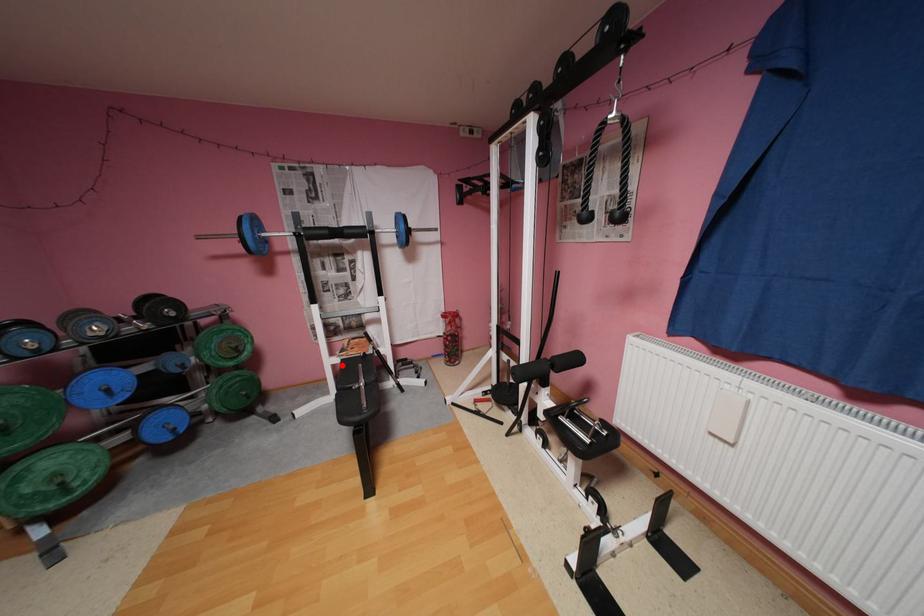
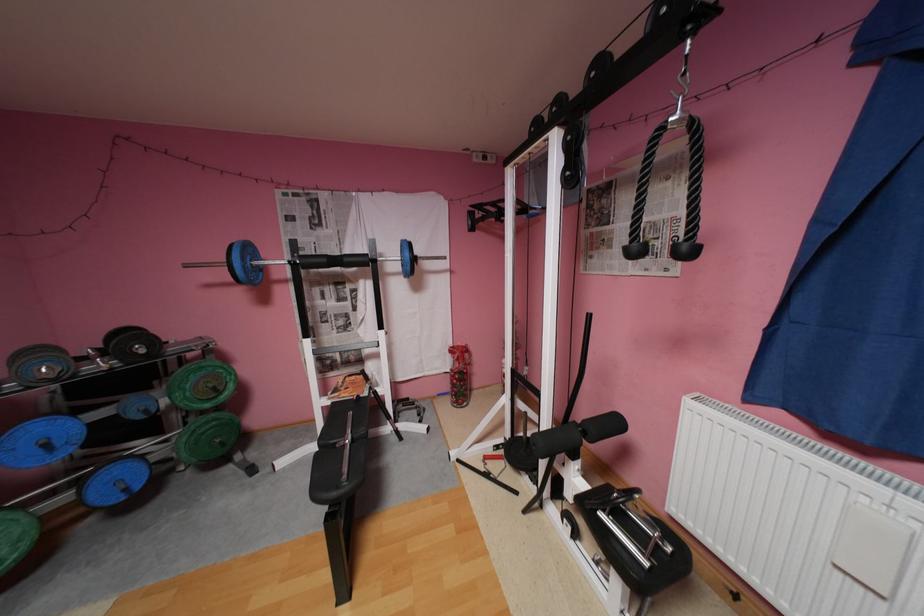
Find the pixel in the second image that matches the highlighted location in the first image.

(333, 408)